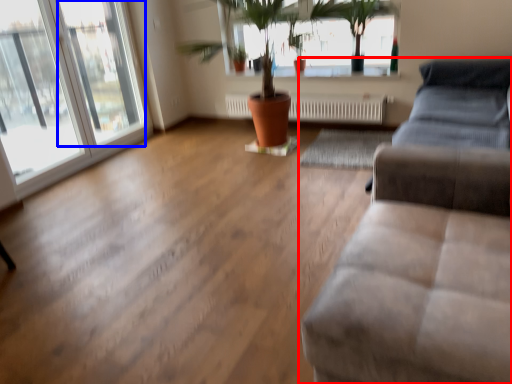
Question: Among these objects, which one is farthest to the camera, studio couch (highlighted by a red box) or window (highlighted by a blue box)?

Choices:
 (A) studio couch
 (B) window

Answer: (B)